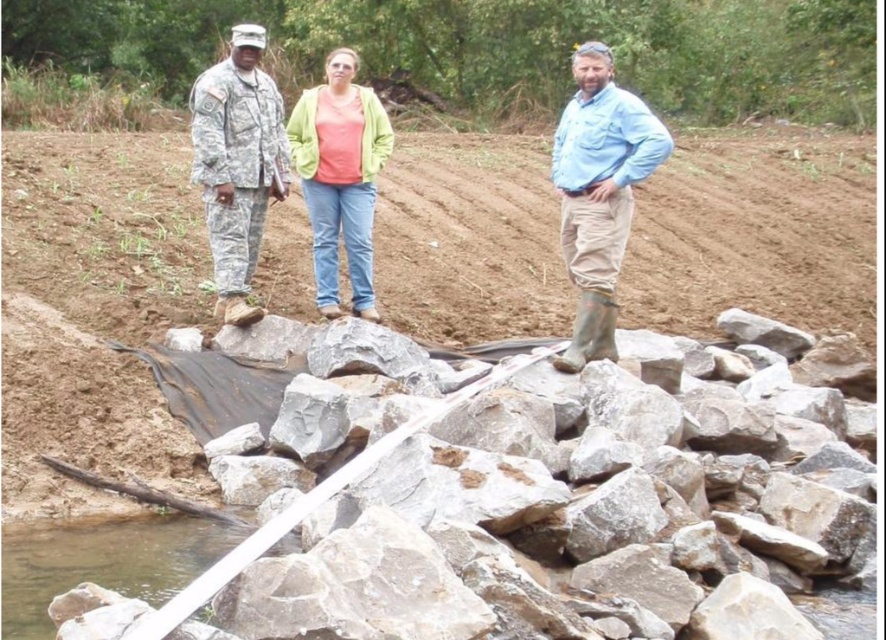
Question: Does gray rough rock at center appear on the left side of camouflage fabric uniform at center?

Choices:
 (A) no
 (B) yes

Answer: (A)

Question: Can you confirm if blue cotton shirt at center is positioned above camouflage fabric uniform at center?

Choices:
 (A) no
 (B) yes

Answer: (B)

Question: Which of the following is the closest to the observer?

Choices:
 (A) clear water at lower left
 (B) light green fabric jacket at center

Answer: (A)

Question: Which is farther from the clear water at lower left?

Choices:
 (A) light green fabric jacket at center
 (B) camouflage fabric uniform at center
 (C) blue cotton shirt at center
 (D) gray rough rock at center

Answer: (C)

Question: Which is farther from the light green fabric jacket at center?

Choices:
 (A) blue cotton shirt at center
 (B) gray rough rock at center
 (C) camouflage fabric uniform at center
 (D) clear water at lower left

Answer: (A)

Question: Is gray rough rock at center thinner than clear water at lower left?

Choices:
 (A) no
 (B) yes

Answer: (A)